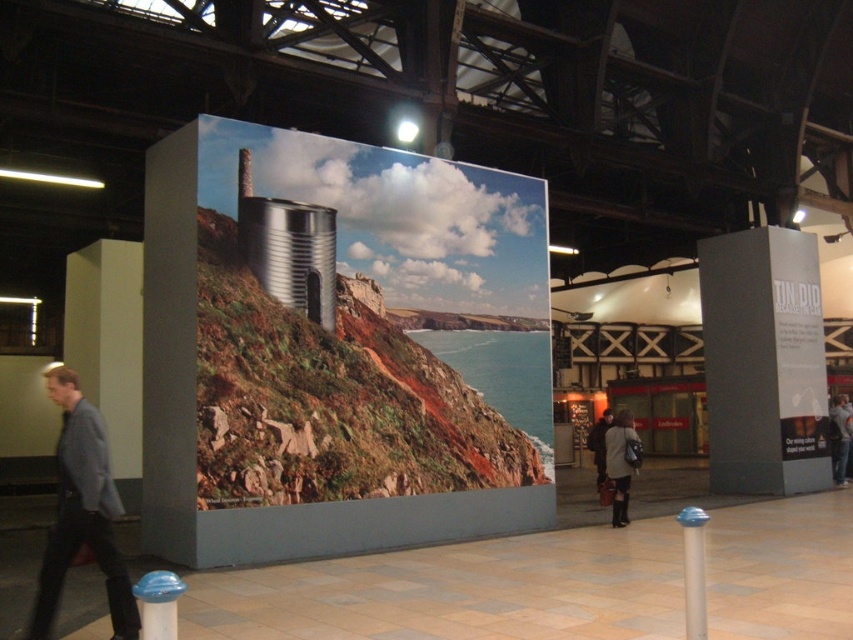
Question: Observing the image, what is the correct spatial positioning of gray fabric jacket at left in reference to blue plastic trash can at lower left?

Choices:
 (A) left
 (B) right

Answer: (A)

Question: Can you confirm if metallic silver tank at center is positioned below dark gray coat at center?

Choices:
 (A) yes
 (B) no

Answer: (B)

Question: Is metallic silver tank at center further to the viewer compared to blue plastic trash can at lower left?

Choices:
 (A) yes
 (B) no

Answer: (A)

Question: Which of these objects is positioned closest to the matte gray pillar at center?

Choices:
 (A) dark brown leather jacket at lower right
 (B) translucent plastic pillar at center
 (C) black glossy sign at right

Answer: (B)

Question: Which object appears closest to the camera in this image?

Choices:
 (A) dark brown leather jacket at lower right
 (B) matte gray pillar at center

Answer: (B)

Question: Among these objects, which one is farthest from the camera?

Choices:
 (A) gray fabric jacket at left
 (B) blue plastic trash can at lower left

Answer: (A)